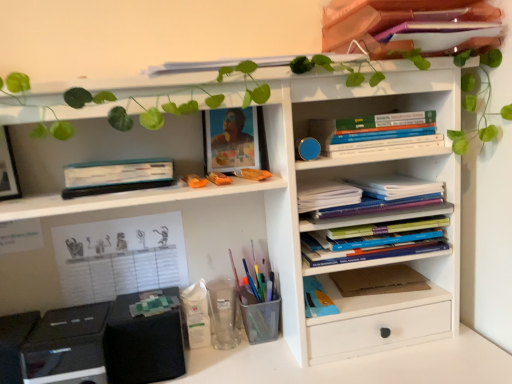
Where is `empty space that is ontop of teal matte hardcover book at left, the 3th paperback book when ordered from bottom to top (from a real-world perspective)`? The width and height of the screenshot is (512, 384). empty space that is ontop of teal matte hardcover book at left, the 3th paperback book when ordered from bottom to top (from a real-world perspective) is located at coordinates (122, 158).